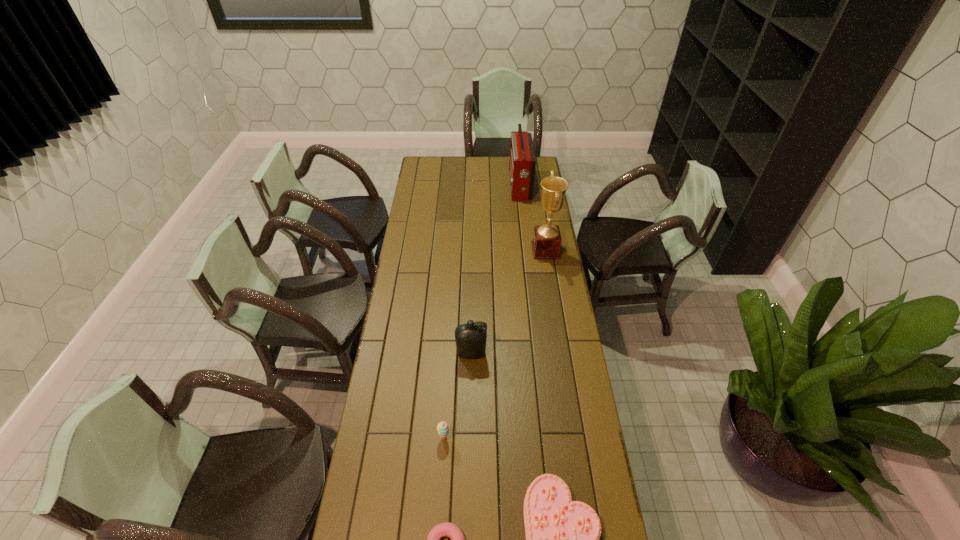
Locate an element on the screen. The image size is (960, 540). the fifth nearest object is located at coordinates (546, 244).

Where is `trophy cup`? Image resolution: width=960 pixels, height=540 pixels. trophy cup is located at coordinates (546, 244).

Find the location of a particular element. The width and height of the screenshot is (960, 540). radio receiver is located at coordinates (522, 163).

I want to click on the fifth shortest object, so click(x=522, y=163).

You are a GUI agent. You are given a task and a screenshot of the screen. Output one action in this format:
    pyautogui.click(x=<x>, y=<y>)
    Task: Click on the bottle
    The image size is (960, 540).
    Given the screenshot: What is the action you would take?
    pyautogui.click(x=470, y=338)

Locate an element on the screen. The height and width of the screenshot is (540, 960). the fourth shortest object is located at coordinates (470, 338).

You are a GUI agent. You are given a task and a screenshot of the screen. Output one action in this format:
    pyautogui.click(x=<x>, y=<y>)
    Task: Click on the third nearest object
    The image size is (960, 540).
    Given the screenshot: What is the action you would take?
    pyautogui.click(x=442, y=428)

You are a GUI agent. You are given a task and a screenshot of the screen. Output one action in this format:
    pyautogui.click(x=<x>, y=<y>)
    Task: Click on the third shortest object
    This screenshot has width=960, height=540.
    Given the screenshot: What is the action you would take?
    pyautogui.click(x=442, y=428)

You are a GUI agent. You are given a task and a screenshot of the screen. Output one action in this format:
    pyautogui.click(x=<x>, y=<y>)
    Task: Click on the free space located on the plaque of the trophy cup
    This screenshot has width=960, height=540.
    Given the screenshot: What is the action you would take?
    pyautogui.click(x=510, y=250)

At what (x,y) coordinates should I click in order to perform the action: click on vacant space located 0.060m on the plaque of the trophy cup. Please return your answer as a coordinate pair (x, y). The width and height of the screenshot is (960, 540). Looking at the image, I should click on (520, 250).